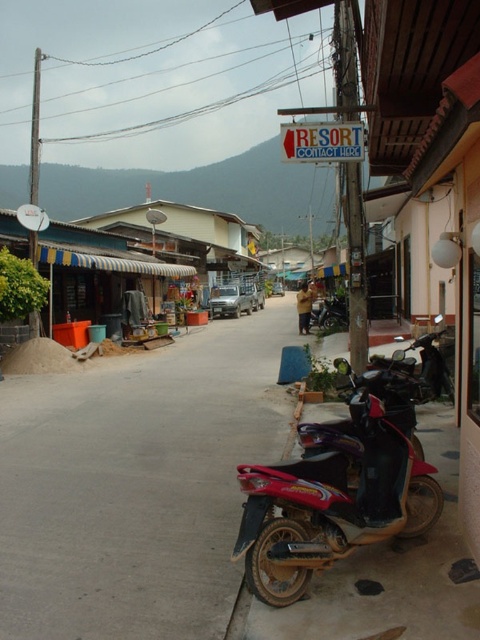
Looking at this image, between smooth concrete alley at center and shiny red motorcycle at lower right, which one appears on the right side from the viewer's perspective?

shiny red motorcycle at lower right is more to the right.

Which is more to the left, smooth concrete alley at center or shiny red motorcycle at lower right?

smooth concrete alley at center

Find the location of a particular element. smooth concrete alley at center is located at coordinates (137, 484).